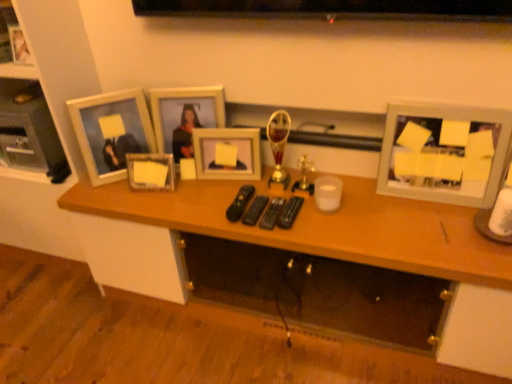
Question: Can you confirm if black plastic remote at center, arranged as the fourth remote control when viewed from the right, is bigger than wooden picture frame at center, which is the third picture frame in left-to-right order?

Choices:
 (A) yes
 (B) no

Answer: (B)

Question: Is black plastic remote at center, positioned as the 1th remote control in left-to-right order, directly adjacent to wooden picture frame at center, the 4th picture frame in the right-to-left sequence?

Choices:
 (A) yes
 (B) no

Answer: (B)

Question: Considering the relative sizes of black plastic remote at center, arranged as the fourth remote control when viewed from the right, and wooden picture frame at center, the 4th picture frame in the right-to-left sequence, in the image provided, is black plastic remote at center, arranged as the fourth remote control when viewed from the right, taller than wooden picture frame at center, the 4th picture frame in the right-to-left sequence,?

Choices:
 (A) no
 (B) yes

Answer: (A)

Question: Can you confirm if black plastic remote at center, arranged as the fourth remote control when viewed from the right, is positioned to the left of wooden picture frame at center, the 4th picture frame in the right-to-left sequence?

Choices:
 (A) no
 (B) yes

Answer: (A)

Question: Can you confirm if black plastic remote at center, positioned as the 1th remote control in left-to-right order, is positioned to the right of wooden picture frame at center, which is the third picture frame in left-to-right order?

Choices:
 (A) no
 (B) yes

Answer: (B)

Question: From the image's perspective, is wooden desk at center positioned above or below matte glass picture frame at center, which appears as the fifth picture frame when viewed from the left?

Choices:
 (A) below
 (B) above

Answer: (A)

Question: Considering the positions of wooden desk at center and matte glass picture frame at center, positioned as the second picture frame in right-to-left order, in the image, is wooden desk at center wider or thinner than matte glass picture frame at center, positioned as the second picture frame in right-to-left order,?

Choices:
 (A) thin
 (B) wide

Answer: (B)

Question: From a real-world perspective, is wooden desk at center above or below matte glass picture frame at center, positioned as the second picture frame in right-to-left order?

Choices:
 (A) above
 (B) below

Answer: (B)

Question: In terms of size, does wooden desk at center appear bigger or smaller than matte glass picture frame at center, which appears as the fifth picture frame when viewed from the left?

Choices:
 (A) big
 (B) small

Answer: (A)

Question: Is black plastic remote control at center, which is the third remote control in right-to-left order, taller or shorter than black glossy television at upper center?

Choices:
 (A) short
 (B) tall

Answer: (A)

Question: Considering the relative positions of black plastic remote control at center, which is the third remote control in right-to-left order, and black glossy television at upper center in the image provided, is black plastic remote control at center, which is the third remote control in right-to-left order, to the left or to the right of black glossy television at upper center?

Choices:
 (A) right
 (B) left

Answer: (B)

Question: From a real-world perspective, is black plastic remote control at center, which appears as the 2th remote control when viewed from the left, above or below black glossy television at upper center?

Choices:
 (A) above
 (B) below

Answer: (B)

Question: Is black plastic remote control at center, which appears as the 2th remote control when viewed from the left, in front of or behind black glossy television at upper center in the image?

Choices:
 (A) front
 (B) behind

Answer: (B)

Question: From a real-world perspective, is white matte picture frame at upper left, arranged as the fifth picture frame when viewed from the right, above or below black plastic remote at center, arranged as the fourth remote control when viewed from the right?

Choices:
 (A) below
 (B) above

Answer: (B)

Question: Is white matte picture frame at upper left, the second picture frame viewed from the left, in front of or behind black plastic remote at center, positioned as the 1th remote control in left-to-right order, in the image?

Choices:
 (A) front
 (B) behind

Answer: (B)